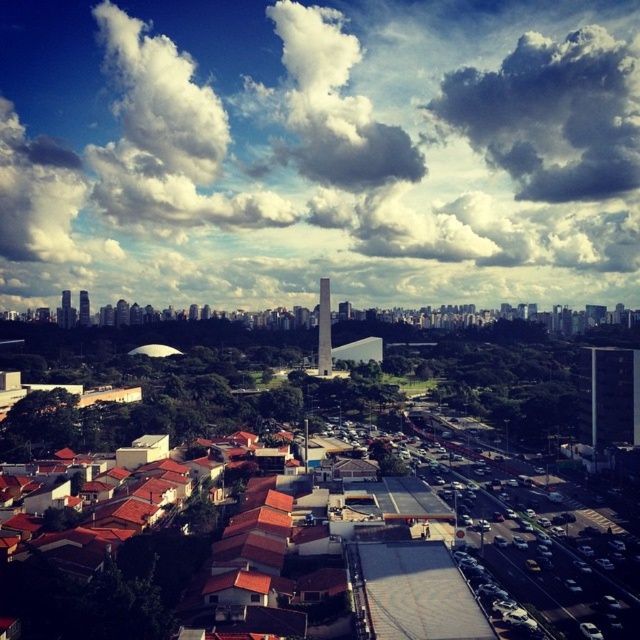
Does white fluffy cloud at center have a larger size compared to cloudy sky at upper center?

Indeed, white fluffy cloud at center has a larger size compared to cloudy sky at upper center.

Is white fluffy cloud at center thinner than cloudy sky at upper center?

In fact, white fluffy cloud at center might be wider than cloudy sky at upper center.

Is point (252, 244) behind point (445, 106)?

That is False.

I want to click on white fluffy cloud at center, so click(320, 148).

Measure the distance from white fluffy cloud at center to matte gray tower at left.

A distance of 690.60 feet exists between white fluffy cloud at center and matte gray tower at left.

Is white fluffy cloud at center wider than matte gray tower at left?

Yes, white fluffy cloud at center is wider than matte gray tower at left.

Is point (192, 104) farther from viewer compared to point (65, 316)?

Yes.

At what (x,y) coordinates should I click in order to perform the action: click on white fluffy cloud at center. Please return your answer as a coordinate pair (x, y). Looking at the image, I should click on (320, 148).

Between white fluffy cloud at center and white glass tower at center, which one is positioned higher?

white fluffy cloud at center is higher up.

Does white fluffy cloud at center have a larger size compared to white glass tower at center?

Yes.

Which is in front, point (182, 10) or point (317, 285)?

Point (317, 285) is more forward.

The image size is (640, 640). I want to click on white fluffy cloud at center, so click(x=320, y=148).